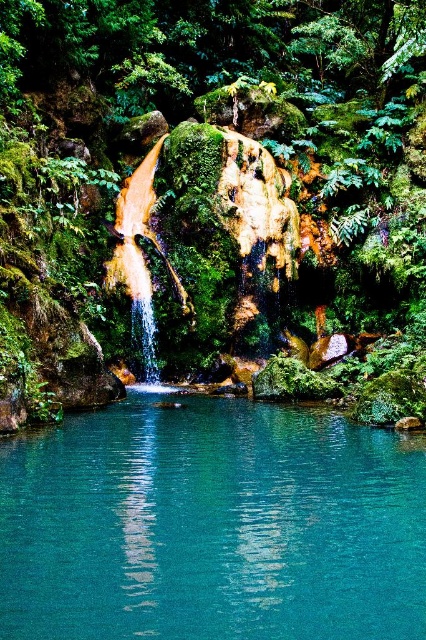
You are a hiker who wants to cross the teal glass pool at center. You have a 3m long wooden plank. The green mossy rock at center is in the middle of the pool. Can you place the plank from the edge of the pool to the rock and then to the other side?

The green mossy rock at center is bigger than teal glass pool at center. Therefore, the rock is larger than the pool, making it impossible to place the plank as the rock would block the path. Alternatively, the size comparison might mean the pool is smaller, but since the rock is in the center, the distance between edges might still be manageable. However, without knowing the exact dimensions, it is uncertain. The answer is unclear based on the given information.

You are standing at the camera position and want to reach the point marked as point (253, 120). If your walking speed is 1.5 meters per second, how long will it take you to reach that point?

The distance between you and point (253, 120) is 76.31 meters. At a speed of 1.5 meters per second, it would take approximately 50.87 seconds to reach the point.

Looking at this image, you are standing at the edge of the waterfall pool in the image. There is a point marked at coordinates (212,172). What can you see at that point?

The point at (212,172) marks a green mossy rock at center.